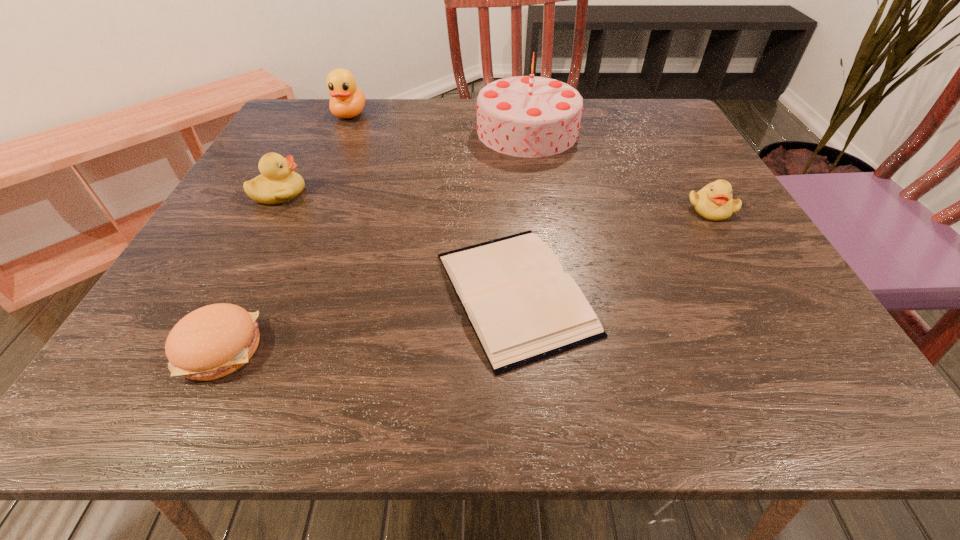
Identify the location of birthday cake. Image resolution: width=960 pixels, height=540 pixels. (524, 116).

At what (x,y) coordinates should I click in order to perform the action: click on the tallest duckling. Please return your answer as a coordinate pair (x, y). Looking at the image, I should click on pos(347,101).

Locate an element on the screen. Image resolution: width=960 pixels, height=540 pixels. the farthest duckling is located at coordinates (347, 101).

At what (x,y) coordinates should I click in order to perform the action: click on the fourth shortest object. Please return your answer as a coordinate pair (x, y). This screenshot has width=960, height=540. Looking at the image, I should click on (278, 183).

Locate an element on the screen. The image size is (960, 540). the rightmost object is located at coordinates (714, 202).

Find the location of a particular element. the fourth tallest object is located at coordinates (714, 202).

What are the coordinates of `patty` in the screenshot? It's located at click(x=213, y=341).

Where is `the shortest object`? the shortest object is located at coordinates (523, 308).

At what (x,y) coordinates should I click in order to perform the action: click on free space located 0.170m on the front of the tallest object. Please return your answer as a coordinate pair (x, y). Image resolution: width=960 pixels, height=540 pixels. Looking at the image, I should click on (539, 205).

Find the location of a particular element. This screenshot has width=960, height=540. free space located on the face of the farthest duckling is located at coordinates (329, 160).